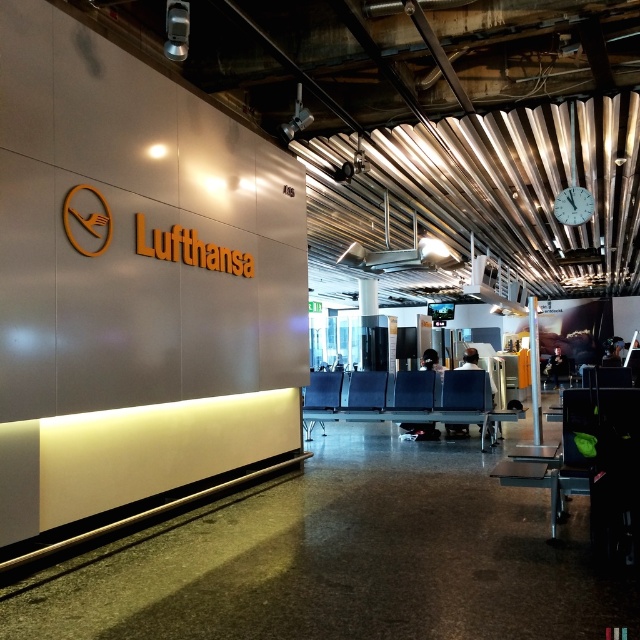
Question: Where is matte blue chair at center located in relation to metallic clock at upper right in the image?

Choices:
 (A) left
 (B) right

Answer: (A)

Question: Does matte blue chair at center have a larger size compared to metallic clock at upper right?

Choices:
 (A) no
 (B) yes

Answer: (B)

Question: Does black leather chair at center lie behind matte blue chair at center?

Choices:
 (A) yes
 (B) no

Answer: (B)

Question: Based on their relative distances, which object is farther from the black leather chair at center?

Choices:
 (A) metallic blue chair at center
 (B) metallic clock at upper right
 (C) black plastic chair at right
 (D) matte blue chair at center

Answer: (C)

Question: Which object is positioned closest to the matte blue chair at center?

Choices:
 (A) metallic clock at upper right
 (B) black plastic chair at right
 (C) metallic blue chair at center
 (D) black leather chair at center

Answer: (C)

Question: Considering the real-world distances, which object is closest to the black plastic chair at right?

Choices:
 (A) matte blue chair at center
 (B) metallic blue chair at center

Answer: (A)